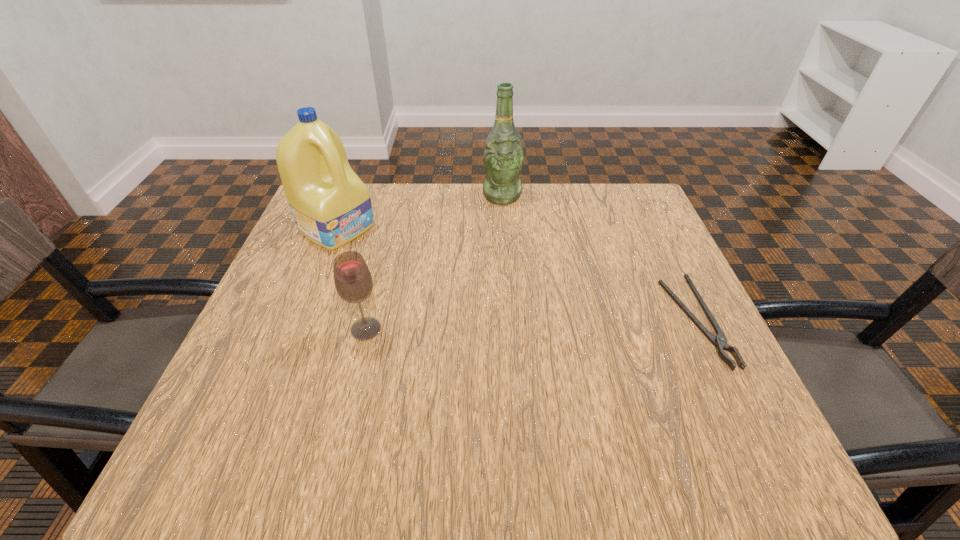
Where is `free space on the desktop that is between the third object from right to left and the rightmost object and is positioned on the label of the detergent`? free space on the desktop that is between the third object from right to left and the rightmost object and is positioned on the label of the detergent is located at coordinates (504, 326).

I want to click on free space on the desktop that is between the glass drink container and the rightmost object and is positioned on the surface of the beer bottle, so click(516, 326).